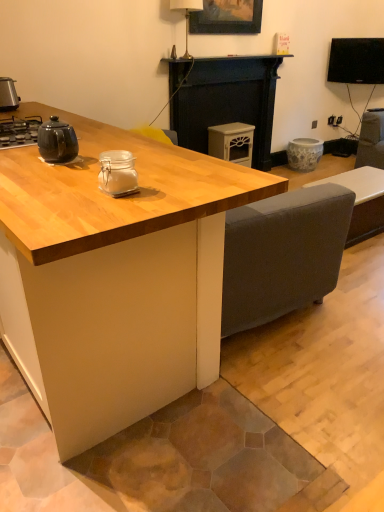
Question: In terms of width, does black glossy tv at upper right look wider or thinner when compared to black matte fireplace at center?

Choices:
 (A) wide
 (B) thin

Answer: (B)

Question: From the image's perspective, is black glossy tv at upper right above or below black matte fireplace at center?

Choices:
 (A) below
 (B) above

Answer: (B)

Question: Considering the real-world distances, which object is closest to the wooden picture frame at upper center?

Choices:
 (A) light wood table at center
 (B) clear glass jar at center, which appears as the third appliance when viewed from the right
 (C) metallic silver toaster at left, positioned as the first appliance in left-to-right order
 (D) porcelain floral pot at center, positioned as the 4th appliance in front-to-back order
 (E) white ceramic lamp at upper center

Answer: (E)

Question: Which is farther from the matte black teapot at left?

Choices:
 (A) matte cream cabinet at center, marked as the third appliance in a left-to-right arrangement
 (B) white ceramic lamp at upper center
 (C) clear glass jar at center, which is counted as the 4th appliance, starting from the back
 (D) black matte fireplace at center
 (E) black glossy tv at upper right

Answer: (E)